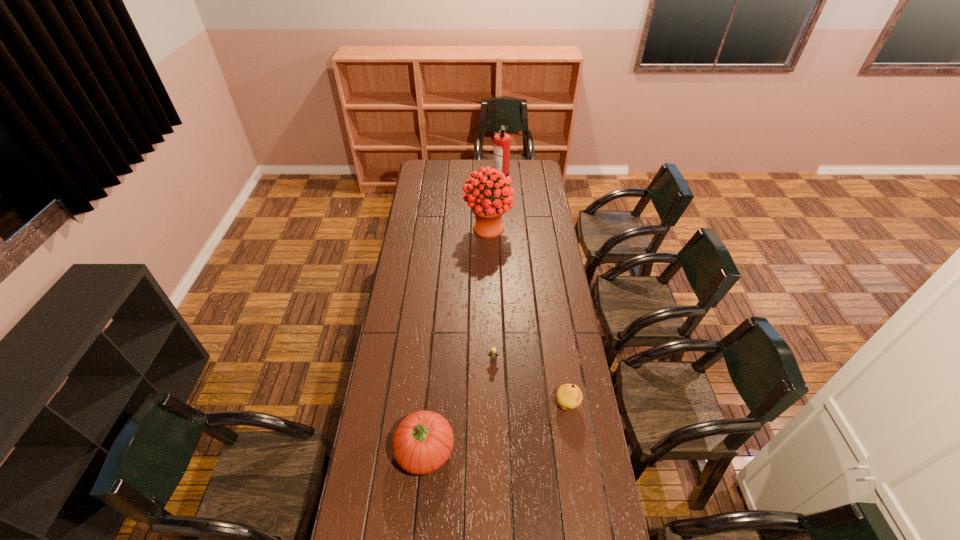
The height and width of the screenshot is (540, 960). Identify the location of vacant region located on the front-facing side of the fire extinguisher. (475, 177).

At what (x,y) coordinates should I click in order to perform the action: click on free space located 0.210m on the front-facing side of the fire extinguisher. Please return your answer as a coordinate pair (x, y). Looking at the image, I should click on (459, 177).

Image resolution: width=960 pixels, height=540 pixels. I want to click on vacant area located on the left of the pumpkin, so (363, 450).

Where is `vacant space located 0.290m on the back of the pear`? The height and width of the screenshot is (540, 960). vacant space located 0.290m on the back of the pear is located at coordinates (556, 334).

What are the coordinates of `vacant space situated in front of the third nearest object` in the screenshot? It's located at (494, 420).

Where is `object that is positioned at the far edge`? Image resolution: width=960 pixels, height=540 pixels. object that is positioned at the far edge is located at coordinates (502, 140).

Locate an element on the screen. This screenshot has width=960, height=540. object that is positioned at the left edge is located at coordinates (423, 441).

Locate an element on the screen. Image resolution: width=960 pixels, height=540 pixels. object located in the right edge section of the desktop is located at coordinates (569, 396).

Where is `vacant region at the left edge of the desktop`? The image size is (960, 540). vacant region at the left edge of the desktop is located at coordinates tap(420, 210).

The height and width of the screenshot is (540, 960). In the image, there is a desktop. In order to click on vacant region at the right edge in this screenshot , I will do `click(545, 209)`.